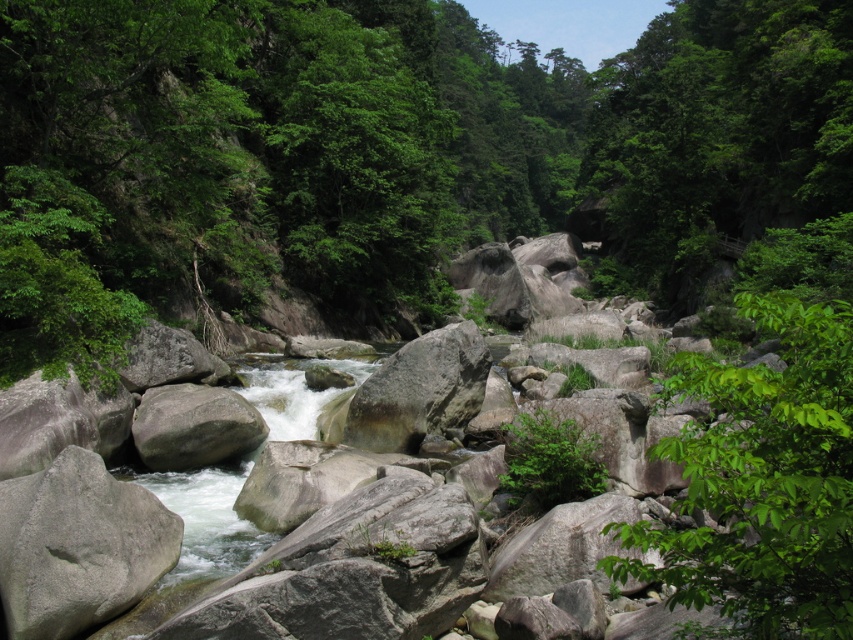
You are a hiker standing at the edge of the river and want to cross to the other side. The gray rough boulder at lower left and the gray rough boulder at center are in your path. Which boulder should you step on first to reach the other side?

You should step on the gray rough boulder at lower left first because it is closer to you than the gray rough boulder at center, making it the first accessible stepping stone towards the other side.